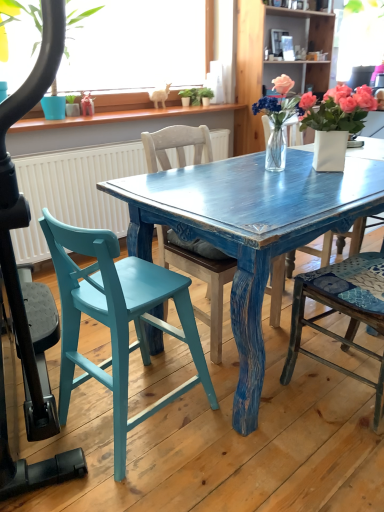
Question: Can you confirm if clear glass vase at center, the second houseplant from the left, is shorter than pink matte flower at upper right?

Choices:
 (A) yes
 (B) no

Answer: (B)

Question: Considering the relative positions of clear glass vase at center, the second houseplant from the left, and pink matte flower at upper right in the image provided, is clear glass vase at center, the second houseplant from the left, to the left of pink matte flower at upper right from the viewer's perspective?

Choices:
 (A) yes
 (B) no

Answer: (A)

Question: From the image's perspective, is clear glass vase at center, the second houseplant from the left, on top of pink matte flower at upper right?

Choices:
 (A) no
 (B) yes

Answer: (A)

Question: Is clear glass vase at center, the second houseplant from the left, completely or partially outside of pink matte flower at upper right?

Choices:
 (A) yes
 (B) no

Answer: (A)

Question: From the image's perspective, is clear glass vase at center, the second houseplant from the left, located beneath pink matte flower at upper right?

Choices:
 (A) no
 (B) yes

Answer: (B)

Question: Considering the relative sizes of clear glass vase at center, the second houseplant from the left, and pink matte flower at upper right in the image provided, is clear glass vase at center, the second houseplant from the left, taller than pink matte flower at upper right?

Choices:
 (A) no
 (B) yes

Answer: (B)

Question: Is the depth of wooden chair at right, the 3th chair when ordered from left to right, greater than that of green matte plant at upper left, the third houseplant in the right-to-left sequence?

Choices:
 (A) no
 (B) yes

Answer: (A)

Question: Would you say wooden chair at right, placed as the first chair when sorted from right to left, contains green matte plant at upper left, the third houseplant in the right-to-left sequence?

Choices:
 (A) no
 (B) yes

Answer: (A)

Question: From the image's perspective, is wooden chair at right, the 3th chair when ordered from left to right, beneath green matte plant at upper left, the third houseplant in the right-to-left sequence?

Choices:
 (A) yes
 (B) no

Answer: (A)

Question: Is wooden chair at right, placed as the first chair when sorted from right to left, at the left side of green matte plant at upper left, the first houseplant from the left?

Choices:
 (A) no
 (B) yes

Answer: (A)

Question: Is wooden chair at right, the 3th chair when ordered from left to right, looking in the opposite direction of green matte plant at upper left, the third houseplant in the right-to-left sequence?

Choices:
 (A) no
 (B) yes

Answer: (A)

Question: Does wooden chair at right, the 3th chair when ordered from left to right, have a lesser height compared to green matte plant at upper left, the first houseplant from the left?

Choices:
 (A) no
 (B) yes

Answer: (A)

Question: Is wooden chair at center, arranged as the 2th chair when viewed from the right, outside of clear glass vase at center, the second houseplant from the left?

Choices:
 (A) yes
 (B) no

Answer: (A)